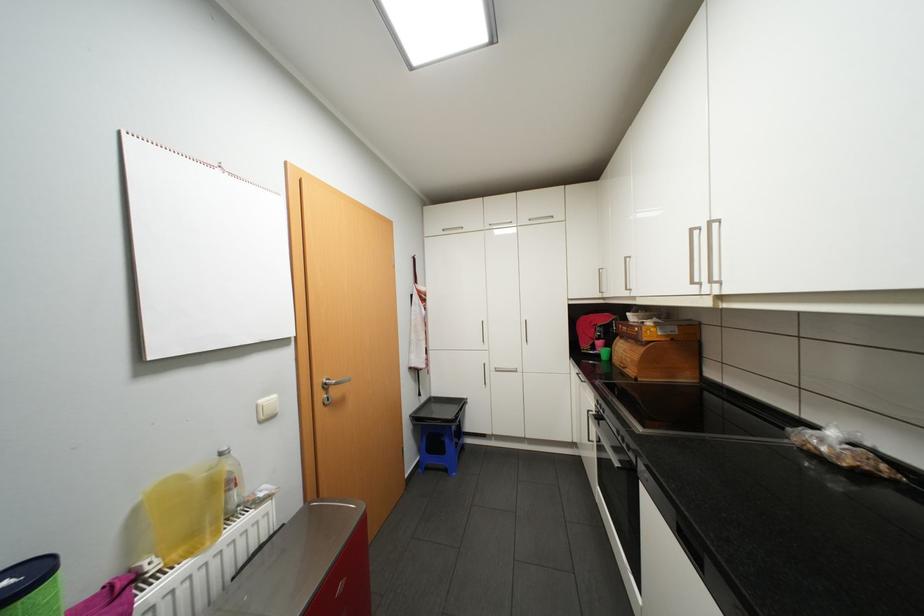
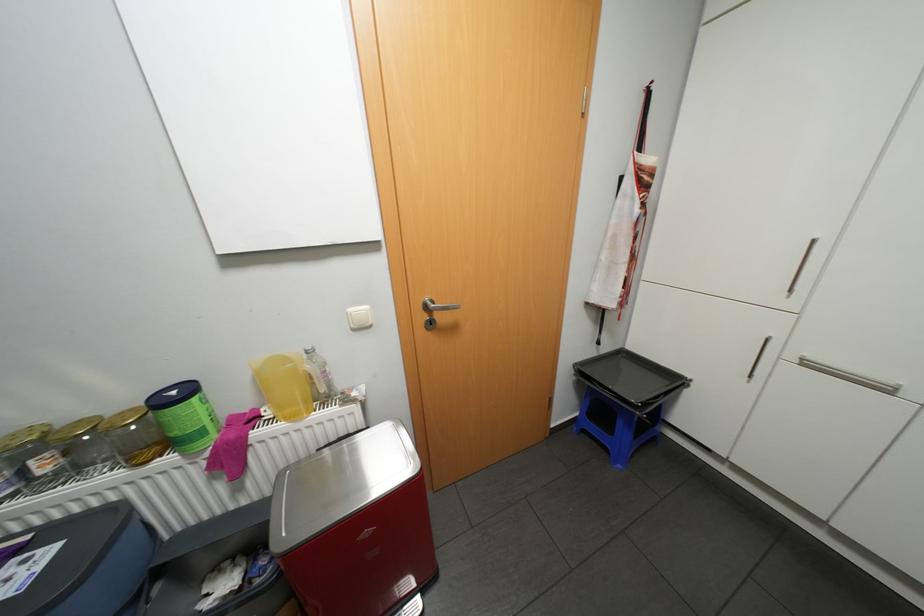
Find the pixel in the second image that matches the point at 269,400 in the first image.

(358, 309)